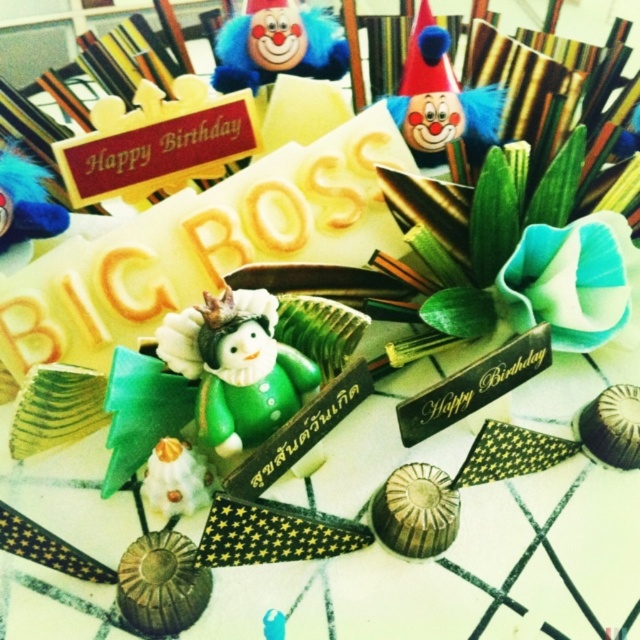
Question: Considering the real-world distances, which object is closest to the matte clown head at upper center?

Choices:
 (A) blue plush clown at upper center
 (B) blue feather at upper left
 (C) green clay figurine at center

Answer: (A)

Question: Observing the image, what is the correct spatial positioning of matte clown head at upper center in reference to blue feather at upper left?

Choices:
 (A) left
 (B) right

Answer: (B)

Question: Does blue plush clown at upper center lie in front of blue feather at upper left?

Choices:
 (A) no
 (B) yes

Answer: (A)

Question: Observing the image, what is the correct spatial positioning of matte clown head at upper center in reference to blue plush clown at upper center?

Choices:
 (A) left
 (B) right

Answer: (B)

Question: Among these points, which one is farthest from the camera?

Choices:
 (A) (28, 228)
 (B) (444, 124)
 (C) (316, 372)
 (D) (284, 20)

Answer: (D)

Question: Among these points, which one is farthest from the camera?

Choices:
 (A) (348, 60)
 (B) (216, 365)
 (C) (452, 131)

Answer: (A)